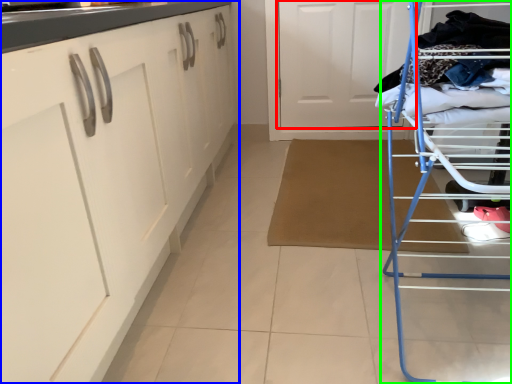
Question: Based on their relative distances, which object is nearer to door (highlighted by a red box)? Choose from cabinetry (highlighted by a blue box) and furniture (highlighted by a green box).

Choices:
 (A) cabinetry
 (B) furniture

Answer: (A)